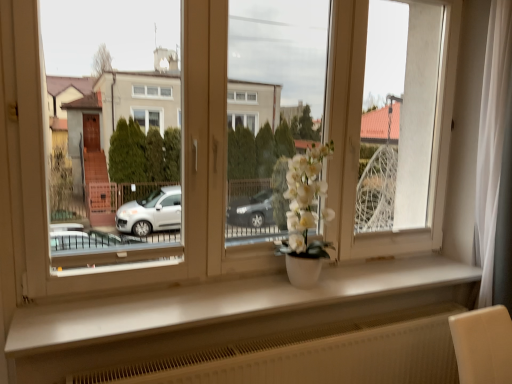
I want to click on vacant position to the left of white matte vase at center, so click(247, 292).